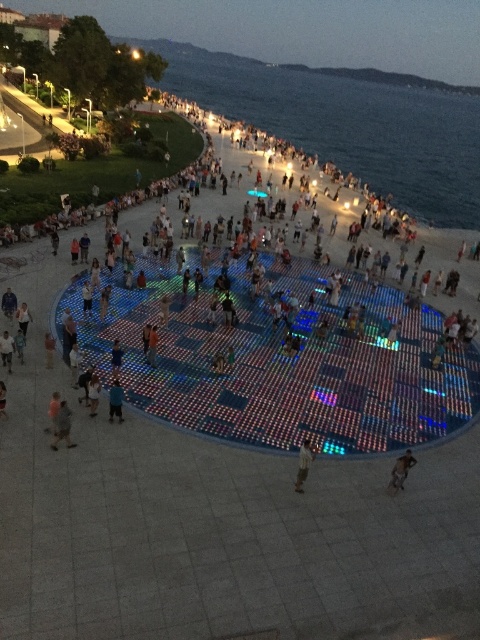
What do you see at coordinates (303, 464) in the screenshot? The image size is (480, 640). I see `light brown fabric pants at center` at bounding box center [303, 464].

Is light brown fabric pants at center taller than dark blue shirt at center?

Correct, light brown fabric pants at center is much taller as dark blue shirt at center.

Is point (308, 461) positioned before point (110, 396)?

Yes, point (308, 461) is closer to viewer.

The width and height of the screenshot is (480, 640). Identify the location of light brown fabric pants at center. (303, 464).

Between blue water at center and brown leather jacket at center, which one is positioned lower?

brown leather jacket at center is lower down.

Can you confirm if blue water at center is positioned above brown leather jacket at center?

Indeed, blue water at center is positioned over brown leather jacket at center.

Describe the element at coordinates (348, 122) in the screenshot. I see `blue water at center` at that location.

Where is `blue water at center`? The image size is (480, 640). blue water at center is located at coordinates (348, 122).

The height and width of the screenshot is (640, 480). I want to click on blue water at center, so click(x=348, y=122).

Which is above, blue water at center or light brown fabric pants at center?

blue water at center is higher up.

Looking at this image, who is more forward, (355,148) or (299,467)?

Positioned in front is point (299,467).

The height and width of the screenshot is (640, 480). Find the location of `blue water at center`. blue water at center is located at coordinates (348, 122).